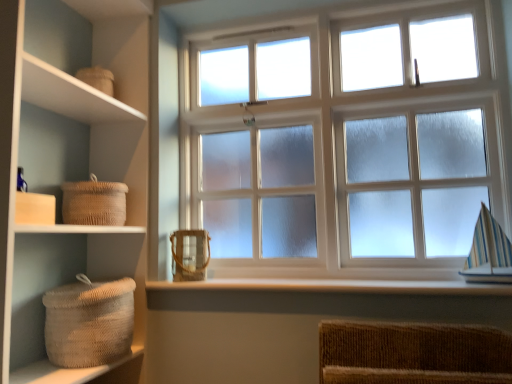
Image resolution: width=512 pixels, height=384 pixels. I want to click on free point above frosted glass window at center (from a real-world perspective), so click(x=298, y=9).